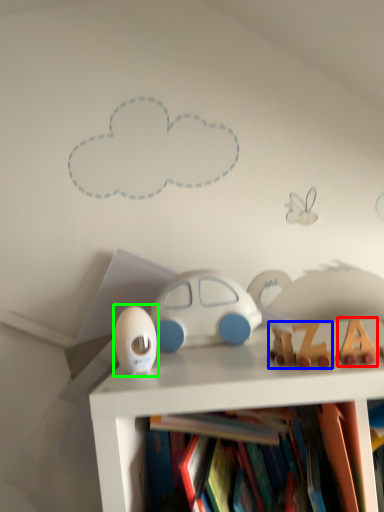
Question: Estimate the real-world distances between objects in this image. Which object is farther from toy (highlighted by a red box), toy (highlighted by a blue box) or toy (highlighted by a green box)?

Choices:
 (A) toy
 (B) toy

Answer: (B)